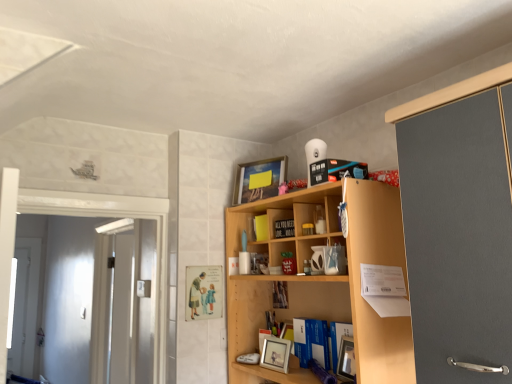
Question: Is white glossy door at left to the right of yellow matte book at upper center, acting as the second book starting from the back, from the viewer's perspective?

Choices:
 (A) yes
 (B) no

Answer: (B)

Question: Is the depth of white glossy door at left greater than that of yellow matte book at upper center, acting as the second book starting from the back?

Choices:
 (A) yes
 (B) no

Answer: (A)

Question: Considering the relative sizes of white glossy door at left and yellow matte book at upper center, which is counted as the second book, starting from the top, in the image provided, is white glossy door at left wider than yellow matte book at upper center, which is counted as the second book, starting from the top,?

Choices:
 (A) yes
 (B) no

Answer: (A)

Question: From the image's perspective, does white glossy door at left appear higher than yellow matte book at upper center, acting as the second book starting from the front?

Choices:
 (A) no
 (B) yes

Answer: (A)

Question: From a real-world perspective, is white glossy door at left beneath yellow matte book at upper center, which is counted as the second book, starting from the top?

Choices:
 (A) yes
 (B) no

Answer: (A)

Question: In the image, is wooden shelf at center positioned in front of or behind wooden photo frame at center, the third book positioned from the front?

Choices:
 (A) front
 (B) behind

Answer: (A)

Question: Is wooden shelf at center taller or shorter than wooden photo frame at center, the third book positioned from the front?

Choices:
 (A) short
 (B) tall

Answer: (B)

Question: Which is correct: wooden shelf at center is inside wooden photo frame at center, arranged as the 3th book when viewed from the top, or outside of it?

Choices:
 (A) inside
 (B) outside

Answer: (B)

Question: Is wooden shelf at center wider or thinner than wooden photo frame at center, arranged as the 3th book when viewed from the top?

Choices:
 (A) wide
 (B) thin

Answer: (A)

Question: In terms of height, does matte black book at upper center, placed as the third book when sorted from back to front, look taller or shorter compared to matte silver picture frame at center, placed as the 2th picture frame when sorted from top to bottom?

Choices:
 (A) tall
 (B) short

Answer: (B)

Question: Is matte black book at upper center, placed as the third book when sorted from back to front, wider or thinner than matte silver picture frame at center, placed as the 2th picture frame when sorted from top to bottom?

Choices:
 (A) wide
 (B) thin

Answer: (B)

Question: Considering the positions of point (282, 221) and point (273, 362), is point (282, 221) closer or farther from the camera than point (273, 362)?

Choices:
 (A) farther
 (B) closer

Answer: (A)

Question: Is matte black book at upper center, arranged as the 1th book when viewed from the top, inside the boundaries of matte silver picture frame at center, the 1th picture frame positioned from the front, or outside?

Choices:
 (A) outside
 (B) inside

Answer: (A)

Question: From the image's perspective, is yellow matte book at upper center, acting as the second book starting from the back, located above or below matte silver picture frame at center, the 1th picture frame positioned from the front?

Choices:
 (A) above
 (B) below

Answer: (A)

Question: Considering the relative positions of yellow matte book at upper center, marked as the 2th book in a bottom-to-top arrangement, and matte silver picture frame at center, the 2th picture frame from the back, in the image provided, is yellow matte book at upper center, marked as the 2th book in a bottom-to-top arrangement, to the left or to the right of matte silver picture frame at center, the 2th picture frame from the back,?

Choices:
 (A) right
 (B) left

Answer: (B)